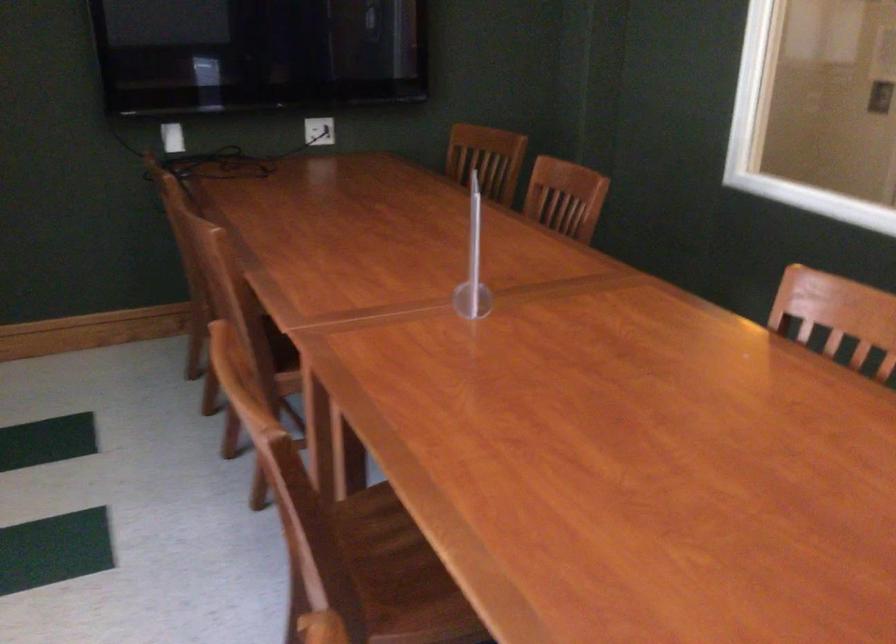
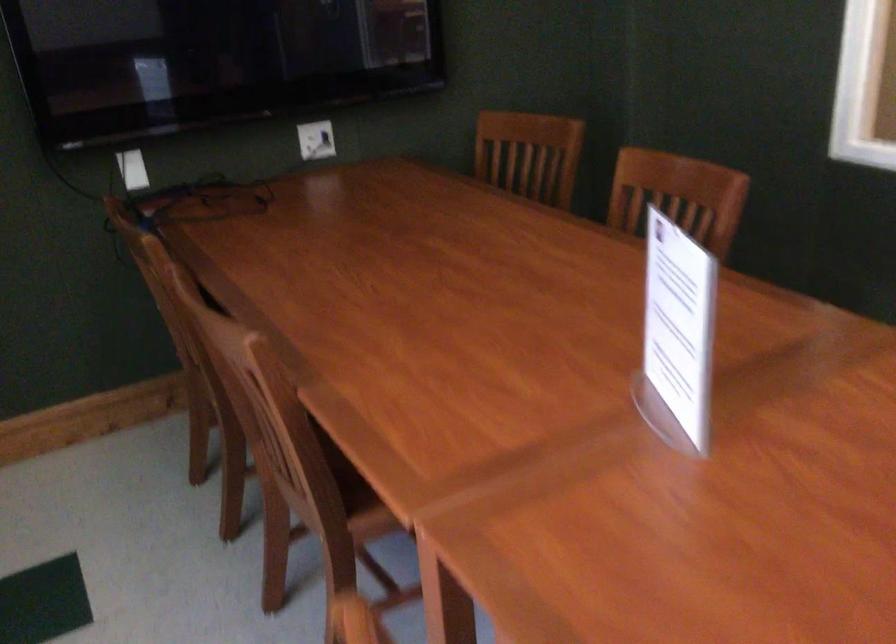
Where in the second image is the point corresponding to (x=246, y=290) from the first image?

(299, 413)